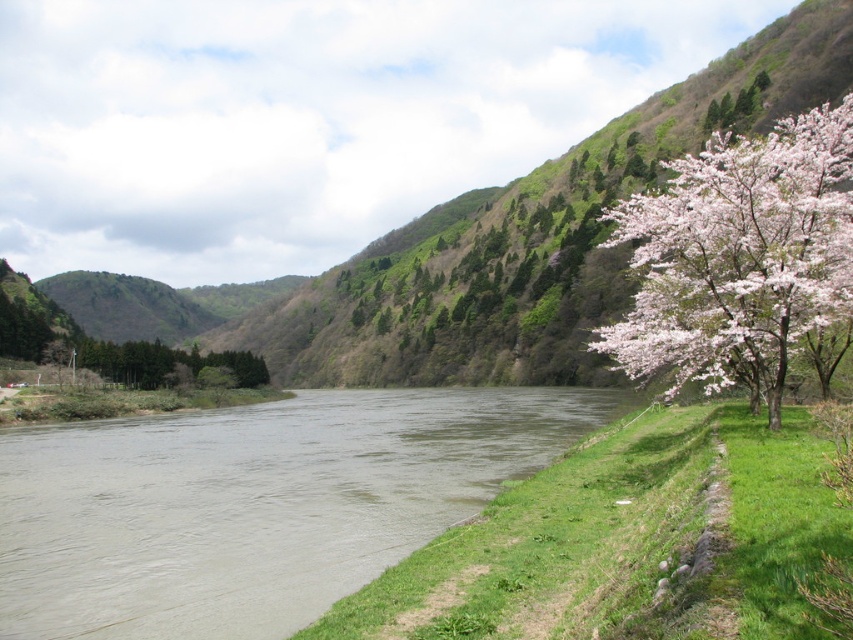
How distant is brown muddy water at lower left from pink bloom at right?

They are 176.64 feet apart.

Does brown muddy water at lower left appear over pink bloom at right?

Incorrect, brown muddy water at lower left is not positioned above pink bloom at right.

Where is `brown muddy water at lower left`? brown muddy water at lower left is located at coordinates (254, 502).

At what (x,y) coordinates should I click in order to perform the action: click on brown muddy water at lower left. Please return your answer as a coordinate pair (x, y). Image resolution: width=853 pixels, height=640 pixels. Looking at the image, I should click on (254, 502).